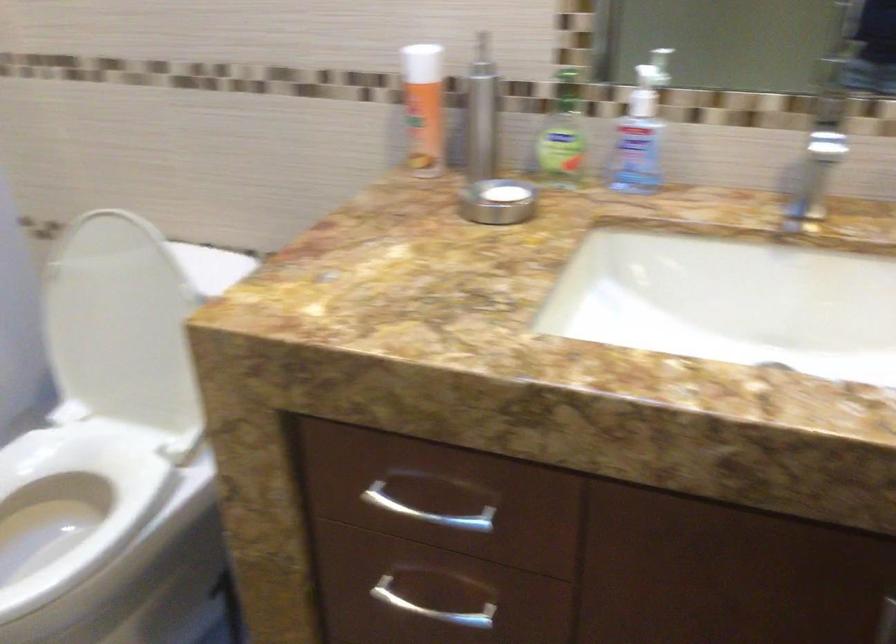
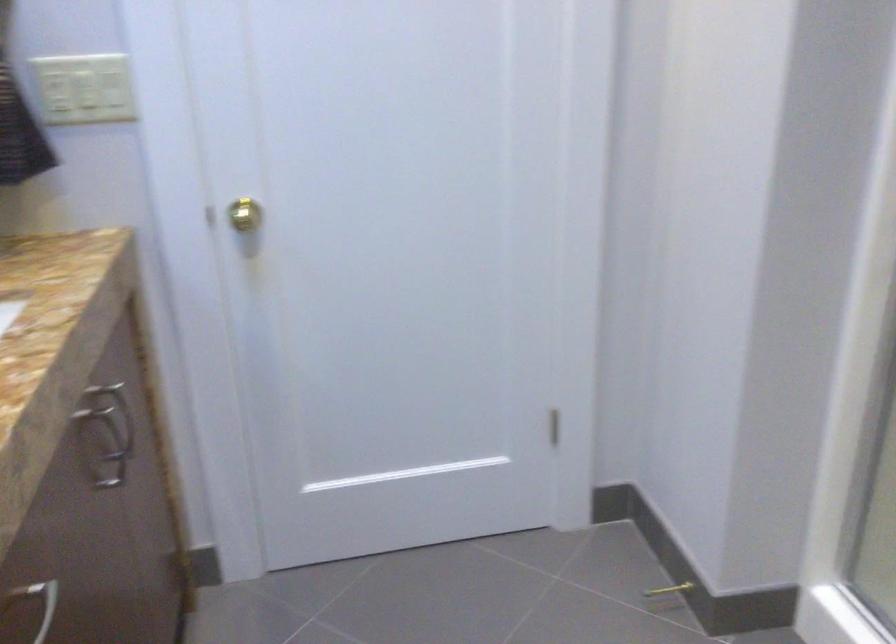
Find the pixel in the second image that matches the point at 574,484 in the first image.

(37, 603)